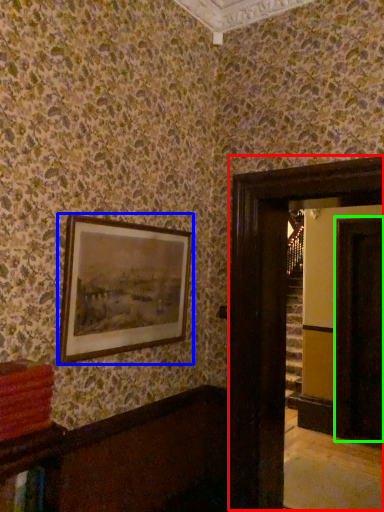
Question: Which is nearer to the glass door (highlighted by a red box)? picture frame (highlighted by a blue box) or glass door (highlighted by a green box).

Choices:
 (A) picture frame
 (B) glass door

Answer: (A)